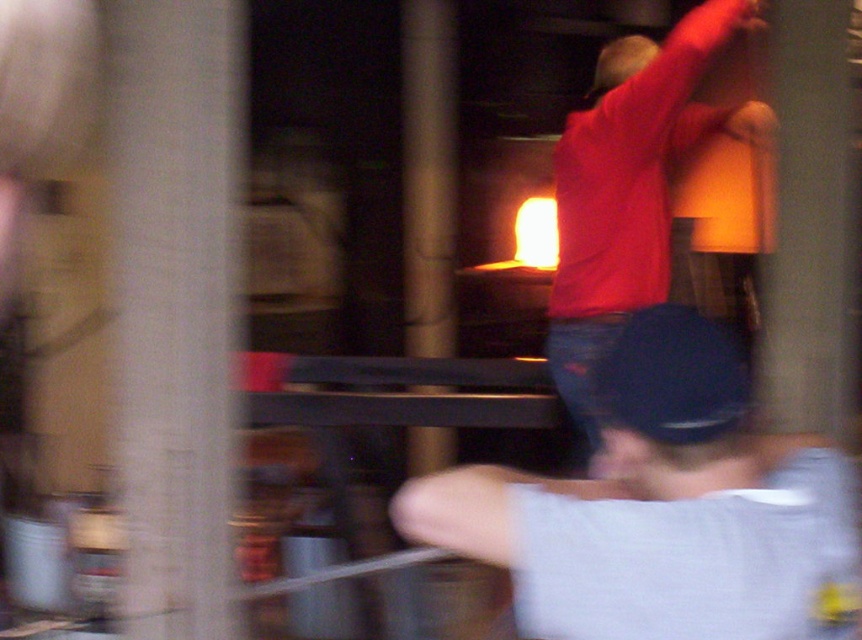
Question: Is dark blue jeans at center to the left of black matte baseball hat at center from the viewer's perspective?

Choices:
 (A) yes
 (B) no

Answer: (A)

Question: Which object is positioned farthest from the black matte baseball hat at center?

Choices:
 (A) matte red shirt at center
 (B) dark blue jeans at center

Answer: (A)

Question: Estimate the real-world distances between objects in this image. Which object is closer to the black matte baseball hat at center?

Choices:
 (A) dark blue jeans at center
 (B) matte red shirt at center

Answer: (A)

Question: Among these objects, which one is nearest to the camera?

Choices:
 (A) black matte baseball hat at center
 (B) matte red shirt at center
 (C) dark blue jeans at center

Answer: (C)

Question: Does matte red shirt at center appear on the left side of black matte baseball hat at center?

Choices:
 (A) yes
 (B) no

Answer: (B)

Question: Does matte red shirt at center have a smaller size compared to black matte baseball hat at center?

Choices:
 (A) yes
 (B) no

Answer: (B)